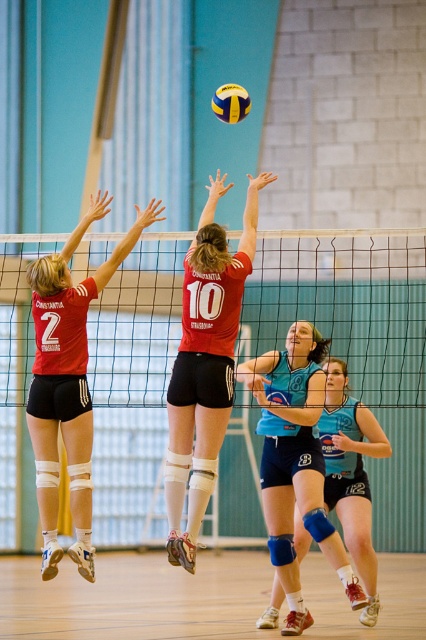
You are a referee watching the volleyball game. You notice two players in the image, one wearing matte black shorts at upper left and another in teal jersey at center. Which of these two players is positioned more to the left side of the court?

The matte black shorts at upper left is positioned to the left of the teal jersey at center, so the player in matte black shorts at upper left is more to the left side of the court.

You are a referee in the volleyball game. You need to determine if the ball is in play based on its position relative to the two points marked in the image. The first point is at coordinates point (85,333) and the second point is at point (285,390). According to the rules, the ball must be in front of both points to be considered in play. Is the ball in play?

Point (85,333) is in front of point (285,390), so the ball must be behind point (85,333) to be in front of both points. Therefore, the ball cannot be in play as it cannot be simultaneously in front of both points if one is already in front of the other.